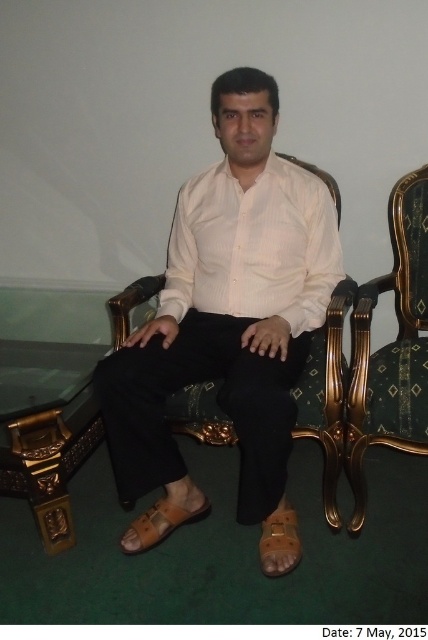
Based on the scene description, which object is wider when comparing the white ribbed shirt at center and the tan leather sandal at lower center?

The white ribbed shirt at center is wider than the tan leather sandal at lower center according to the description.

You are a photographer adjusting your camera settings to capture the two points in the scene. Which point, point (168, 308) or point (265, 531), is closer to the camera lens?

Point (168, 308) is further to the camera than point (265, 531), so point (168, 308) is closer to the camera lens.